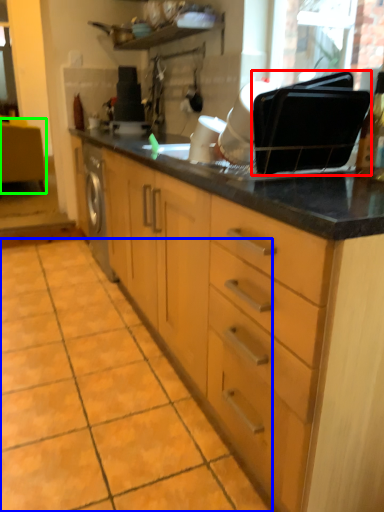
Question: Estimate the real-world distances between objects in this image. Which object is closer to appliance (highlighted by a red box), ceramic tile (highlighted by a blue box) or vanity (highlighted by a green box)?

Choices:
 (A) ceramic tile
 (B) vanity

Answer: (A)